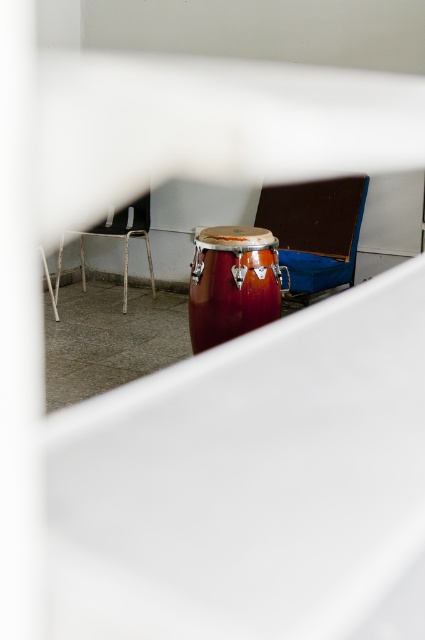
Question: Which of the following is the farthest from the observer?

Choices:
 (A) metallic silver chair at upper left
 (B) wooden chair at center
 (C) shiny brown drum at center

Answer: (A)

Question: Among these points, which one is nearest to the camera?

Choices:
 (A) (56, 275)
 (B) (297, 218)

Answer: (B)

Question: Where is shiny brown drum at center located in relation to wooden chair at center in the image?

Choices:
 (A) right
 (B) left

Answer: (B)

Question: Based on their relative distances, which object is farther from the wooden chair at center?

Choices:
 (A) metallic silver chair at upper left
 (B) shiny brown drum at center

Answer: (A)

Question: Is the position of shiny brown drum at center more distant than that of metallic silver chair at upper left?

Choices:
 (A) yes
 (B) no

Answer: (B)

Question: Can you confirm if wooden chair at center is positioned above metallic silver chair at upper left?

Choices:
 (A) yes
 (B) no

Answer: (A)